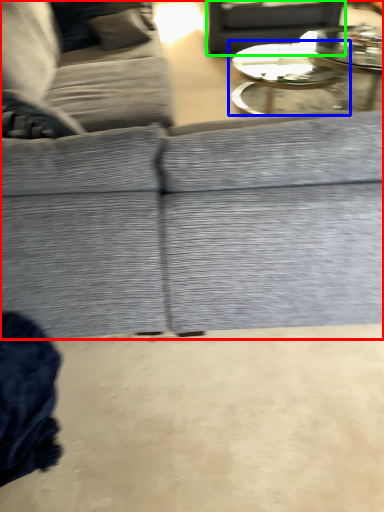
Question: Which object is positioned farthest from studio couch (highlighted by a red box)? Select from coffee table (highlighted by a blue box) and gray (highlighted by a green box).

Choices:
 (A) coffee table
 (B) gray

Answer: (B)